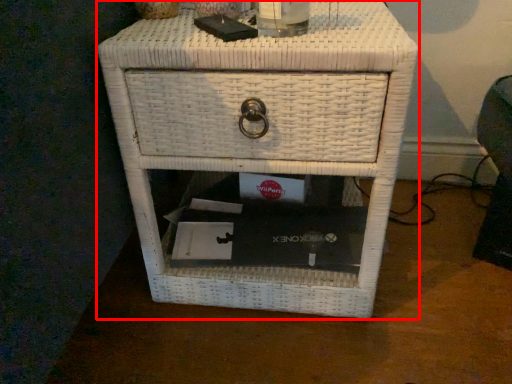
Question: From the image's perspective, where is nightstand (annotated by the red box) located in relation to beverage in the image?

Choices:
 (A) below
 (B) above

Answer: (A)